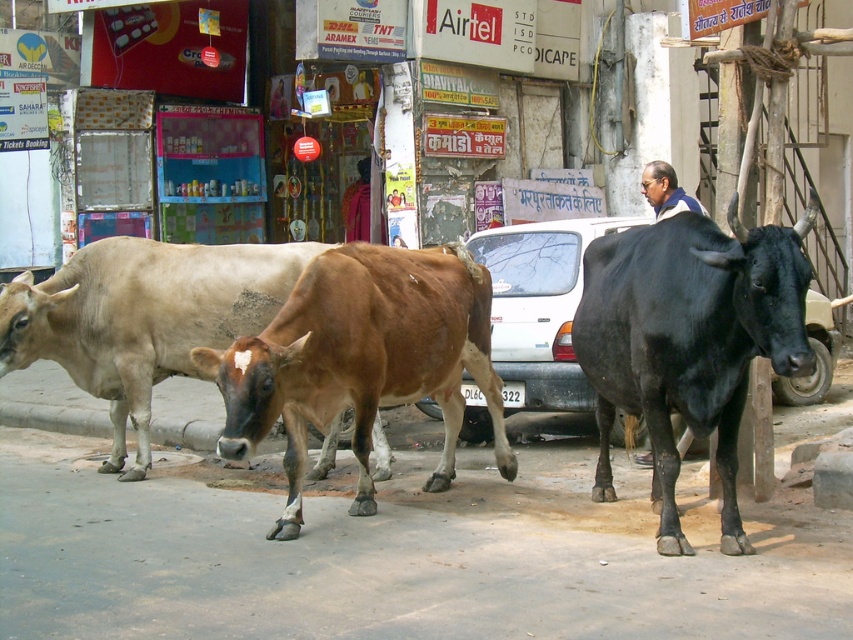
You are a photographer trying to capture both the black glossy bull at right and the brown matte cow at center in a single frame. Given their sizes, which cow should you focus on to ensure both fit in the photo without cropping?

The black glossy bull at right is larger in size than the brown matte cow at center. To ensure both fit in the photo without cropping, you should focus on positioning the larger black glossy bull at right centrally or adjust your camera angle to accommodate its size while still including the brown matte cow at center in the frame.

You are a pedestrian standing at the edge of the road in the image. You see a white matte car at center and a dark blue shirt at center. Which object is closer to you?

The white matte car at center is closer to you because it is located below the dark blue shirt at center, which means it is positioned lower in the image and thus nearer to the viewer.

You are a pedestrian standing at the edge of the road in the scene. You see a white matte car at center and a dark blue shirt at center. Which object is closer to you?

The white matte car at center is closer to you because the dark blue shirt at center is behind it.